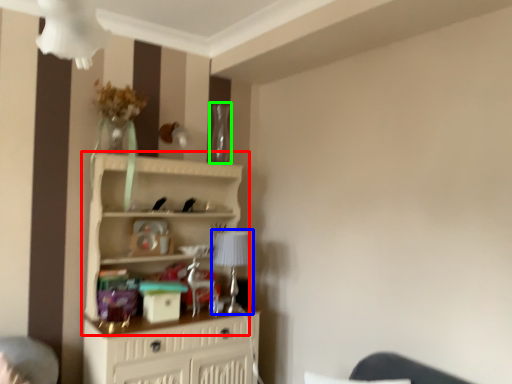
Question: Estimate the real-world distances between objects in this image. Which object is farther from shelf (highlighted by a red box), table lamp (highlighted by a blue box) or glass vase (highlighted by a green box)?

Choices:
 (A) table lamp
 (B) glass vase

Answer: (B)